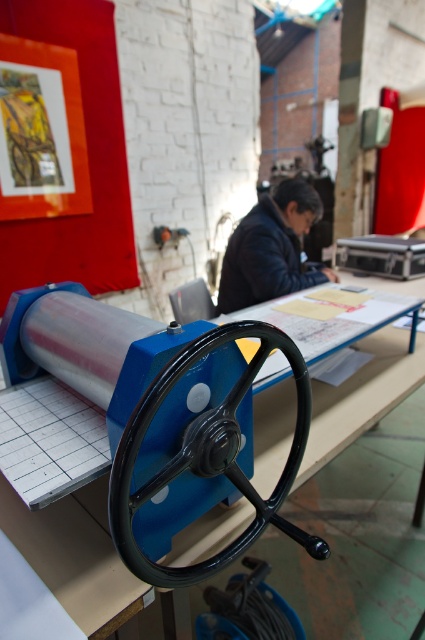
Question: Which object appears closest to the camera in this image?

Choices:
 (A) black polished wheel at center
 (B) dark blue leather jacket at upper center
 (C) blue plastic table at center

Answer: (A)

Question: Considering the relative positions of black polished wheel at center and dark blue leather jacket at upper center in the image provided, where is black polished wheel at center located with respect to dark blue leather jacket at upper center?

Choices:
 (A) above
 (B) below

Answer: (B)

Question: Does black polished wheel at center have a greater width compared to dark blue leather jacket at upper center?

Choices:
 (A) no
 (B) yes

Answer: (A)

Question: From the image, what is the correct spatial relationship of black polished wheel at center in relation to dark blue leather jacket at upper center?

Choices:
 (A) right
 (B) left

Answer: (B)

Question: Which point is closer to the camera?

Choices:
 (A) (405, 333)
 (B) (175, 474)

Answer: (B)

Question: Which object is positioned farthest from the blue plastic table at center?

Choices:
 (A) dark blue leather jacket at upper center
 (B) black polished wheel at center

Answer: (A)